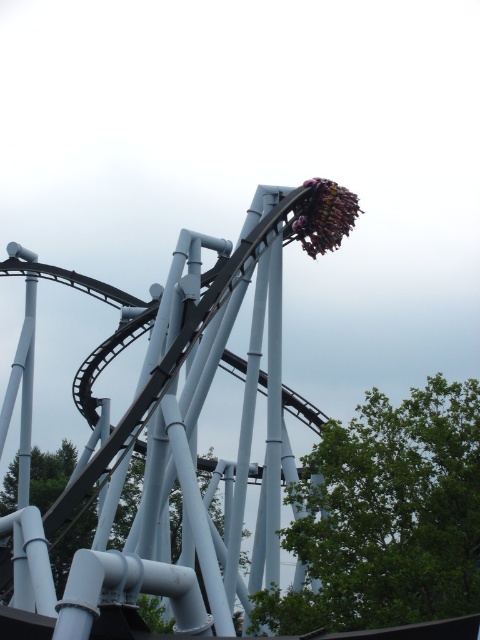
Between metal roller coaster at upper center and green leafy tree at lower right, which one is positioned higher?

Positioned higher is metal roller coaster at upper center.

Which is in front, point (212, 582) or point (365, 417)?

Point (212, 582) is in front.

Locate an element on the screen. This screenshot has width=480, height=640. metal roller coaster at upper center is located at coordinates [x=178, y=435].

Does metal roller coaster at upper center have a larger size compared to green matte tree at center?

Correct, metal roller coaster at upper center is larger in size than green matte tree at center.

Is metal roller coaster at upper center in front of green matte tree at center?

Yes, it is.

Who is more forward, (319, 186) or (55, 556)?

Positioned in front is point (319, 186).

Locate an element on the screen. metal roller coaster at upper center is located at coordinates (178, 435).

Does point (446, 538) come farther from viewer compared to point (12, 496)?

No.

Is green leafy tree at lower right positioned at the back of green matte tree at center?

No, it is in front of green matte tree at center.

Does point (439, 547) come closer to viewer compared to point (149, 620)?

Yes, point (439, 547) is in front of point (149, 620).

This screenshot has width=480, height=640. Identify the location of green leafy tree at lower right. point(386,516).